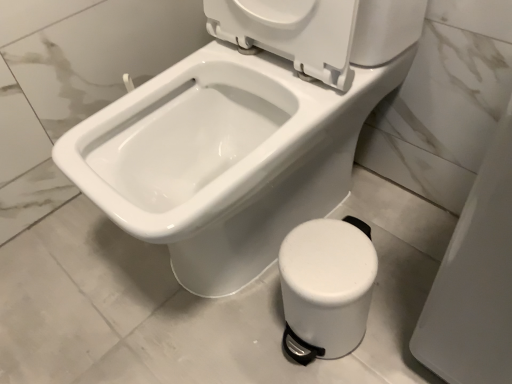
Question: Is white plastic pedal bin at lower right closer to camera compared to white glossy bidet at center?

Choices:
 (A) no
 (B) yes

Answer: (A)

Question: Is white plastic pedal bin at lower right positioned beyond the bounds of white glossy bidet at center?

Choices:
 (A) no
 (B) yes

Answer: (B)

Question: From the image's perspective, would you say white plastic pedal bin at lower right is positioned over white glossy bidet at center?

Choices:
 (A) no
 (B) yes

Answer: (A)

Question: From the image's perspective, is white plastic pedal bin at lower right located beneath white glossy bidet at center?

Choices:
 (A) yes
 (B) no

Answer: (A)

Question: Does white plastic pedal bin at lower right have a larger size compared to white glossy bidet at center?

Choices:
 (A) yes
 (B) no

Answer: (B)

Question: Does white plastic pedal bin at lower right contain white glossy bidet at center?

Choices:
 (A) yes
 (B) no

Answer: (B)

Question: From a real-world perspective, is white glossy bidet at center physically above white plastic pedal bin at lower right?

Choices:
 (A) no
 (B) yes

Answer: (B)

Question: Considering the relative sizes of white glossy bidet at center and white plastic pedal bin at lower right in the image provided, is white glossy bidet at center wider than white plastic pedal bin at lower right?

Choices:
 (A) yes
 (B) no

Answer: (A)

Question: Are white glossy bidet at center and white plastic pedal bin at lower right making contact?

Choices:
 (A) yes
 (B) no

Answer: (B)

Question: Is white glossy bidet at center oriented towards white plastic pedal bin at lower right?

Choices:
 (A) yes
 (B) no

Answer: (B)

Question: Does white glossy bidet at center have a lesser width compared to white plastic pedal bin at lower right?

Choices:
 (A) yes
 (B) no

Answer: (B)

Question: Would you say white glossy bidet at center contains white plastic pedal bin at lower right?

Choices:
 (A) yes
 (B) no

Answer: (B)

Question: Does point (329, 273) appear closer or farther from the camera than point (297, 216)?

Choices:
 (A) closer
 (B) farther

Answer: (A)